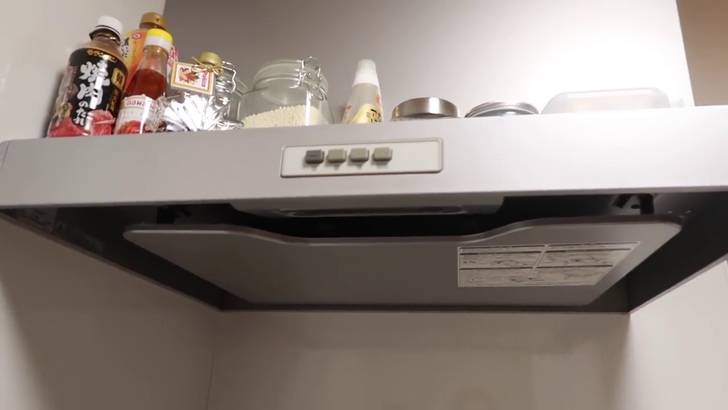
You are a GUI agent. You are given a task and a screenshot of the screen. Output one action in this format:
    pyautogui.click(x=<x>, y=<y>)
    Task: Click on the empty space under shelf
    This screenshot has height=410, width=728.
    Given the screenshot: What is the action you would take?
    pyautogui.click(x=378, y=357)